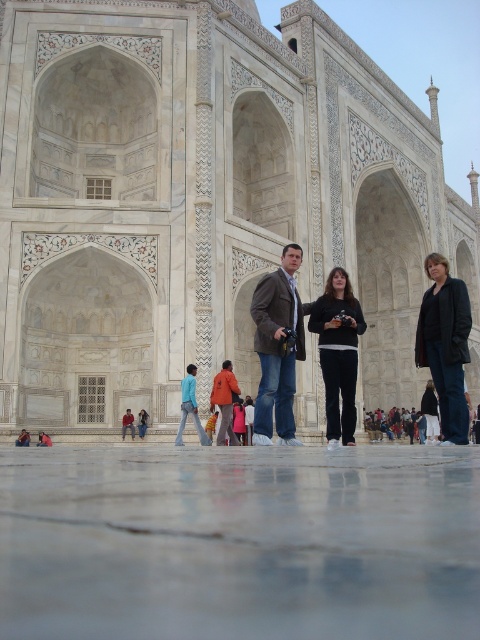
Question: Is white marble palace at center above dark blue jeans at right?

Choices:
 (A) yes
 (B) no

Answer: (A)

Question: Which object is farther from the camera taking this photo?

Choices:
 (A) black cotton pants at center
 (B) light blue denim jeans at center
 (C) matte blue jeans at center
 (D) dark blue jeans at right

Answer: (B)

Question: Which point is farther from the camera taking this photo?

Choices:
 (A) (235, 442)
 (B) (276, 348)
 (C) (160, 160)

Answer: (C)

Question: Is blue denim jeans at center further to camera compared to light blue denim jeans at center?

Choices:
 (A) yes
 (B) no

Answer: (A)

Question: Where is black cotton pants at center located in relation to matte blue jeans at center in the image?

Choices:
 (A) above
 (B) below

Answer: (A)

Question: Which point is farther from the camera taking this photo?

Choices:
 (A) (286, 253)
 (B) (144, 412)
 (C) (452, 323)
 (D) (233, 61)

Answer: (D)